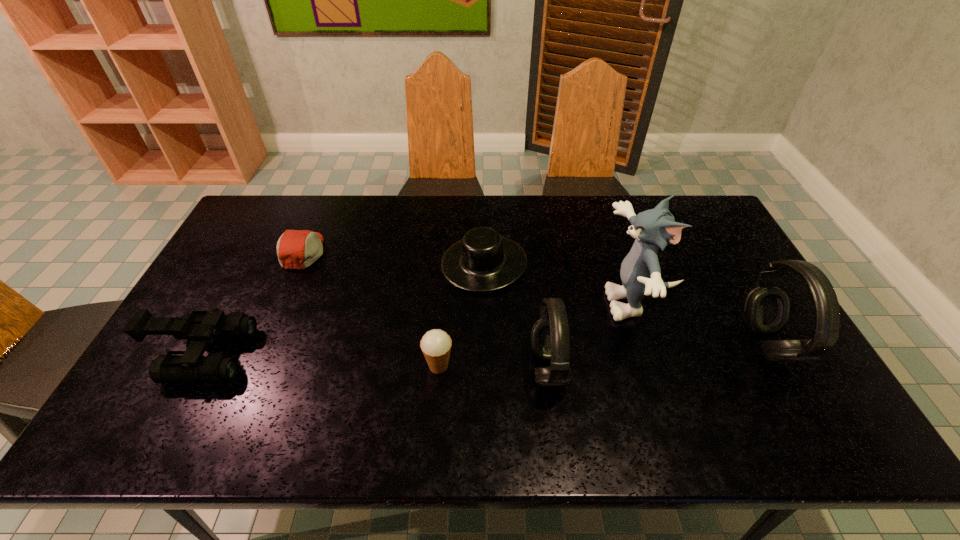
This screenshot has width=960, height=540. What are the coordinates of `free point that keeps the headsets evenly spaced on the left` in the screenshot? It's located at (307, 396).